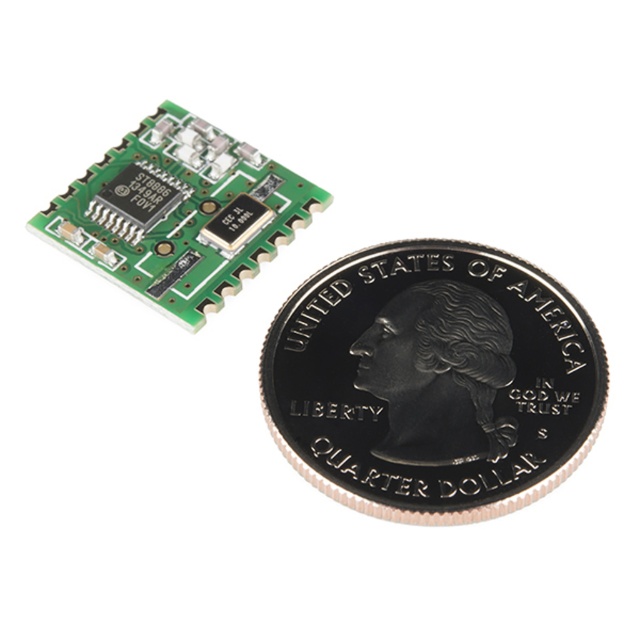
Question: Considering the relative positions of silver/black metallic quarter at center and green circuit board at upper left in the image provided, where is silver/black metallic quarter at center located with respect to green circuit board at upper left?

Choices:
 (A) right
 (B) left

Answer: (A)

Question: Does silver/black metallic quarter at center appear under green circuit board at upper left?

Choices:
 (A) no
 (B) yes

Answer: (B)

Question: Does silver/black metallic quarter at center appear on the right side of green circuit board at upper left?

Choices:
 (A) yes
 (B) no

Answer: (A)

Question: Which object appears closest to the camera in this image?

Choices:
 (A) silver/black metallic quarter at center
 (B) green circuit board at upper left

Answer: (A)